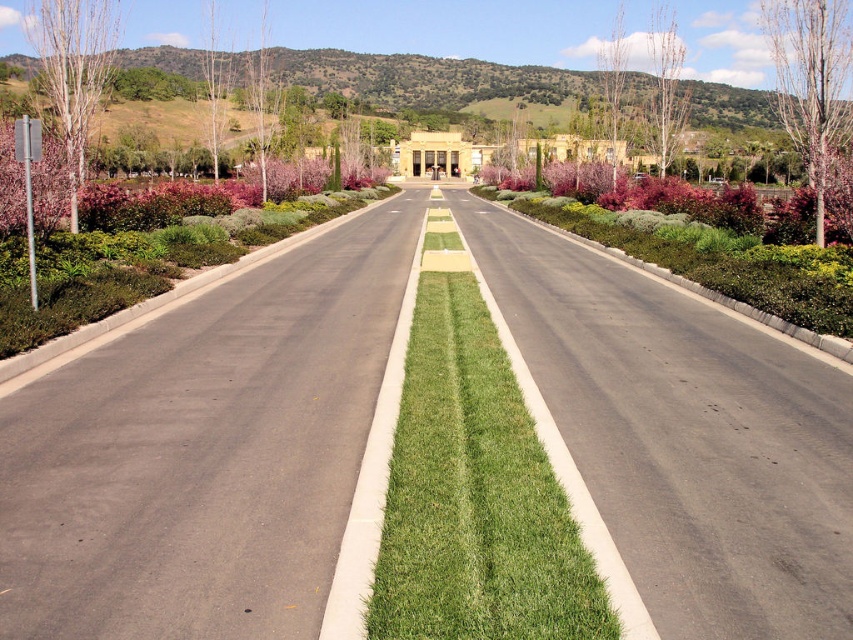
Which is in front, point (802, 116) or point (88, 77)?

Positioned in front is point (802, 116).

This screenshot has width=853, height=640. I want to click on bare bark tree at upper right, so click(811, 83).

Which is behind, point (808, 1) or point (97, 49)?

Positioned behind is point (97, 49).

Locate an element on the screen. The width and height of the screenshot is (853, 640). bare bark tree at upper right is located at coordinates (811, 83).

Can you confirm if smooth white tree at left is positioned to the right of bare branches at center?

In fact, smooth white tree at left is to the left of bare branches at center.

At what (x,y) coordinates should I click in order to perform the action: click on smooth white tree at left. Please return your answer as a coordinate pair (x, y). Looking at the image, I should click on (74, 68).

Is bare bark tree at upper center closer to the viewer compared to bare branches at upper right?

Yes.

How far apart are bare bark tree at upper center and bare branches at upper right?

bare bark tree at upper center and bare branches at upper right are 25.69 feet apart from each other.

Measure the distance between point (665,44) and camera.

Point (665,44) is 168.53 meters from camera.

Where is `bare bark tree at upper center`? The width and height of the screenshot is (853, 640). bare bark tree at upper center is located at coordinates (665, 86).